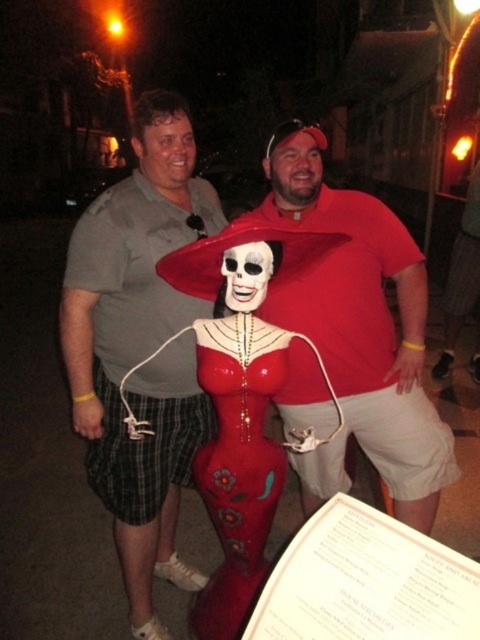
You are a photographer setting up a tripod to capture the scene. The gray cotton shirt at center and the glossy plastic statue at center are both in your view. Which object should you focus on first to ensure both are in sharp focus?

You should focus on the gray cotton shirt at center first because it is closer to you than the glossy plastic statue at center, which is behind it. By focusing on the closer object, both will be in focus if they are within the depth of field.

You are a photographer trying to capture the Catrina figure in the center. You notice a bright light at point (x=141, y=348). Where is this light located in relation to the Catrina figure?

The point (x=141, y=348) is on the gray cotton shirt at center, so the bright light is located on the Catrina figure in the center.